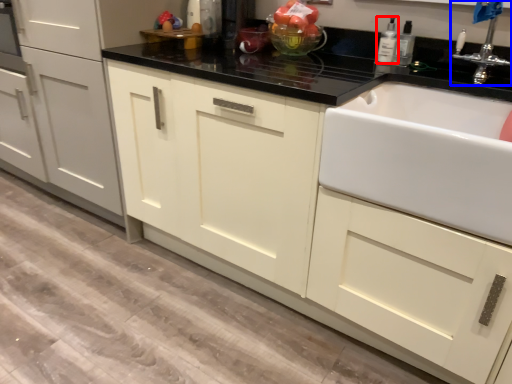
Question: Which object is closer to the camera taking this photo, bottle (highlighted by a red box) or tap (highlighted by a blue box)?

Choices:
 (A) bottle
 (B) tap

Answer: (B)